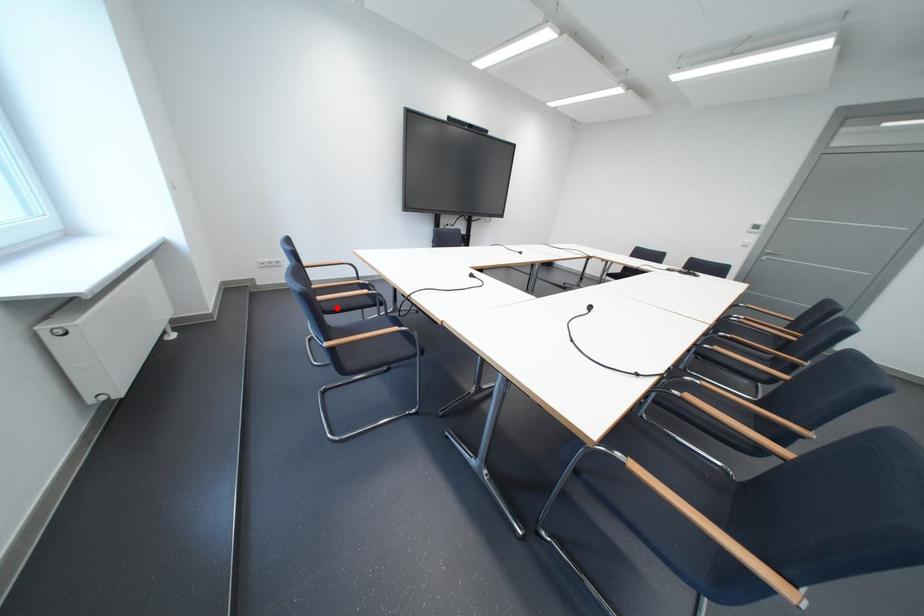
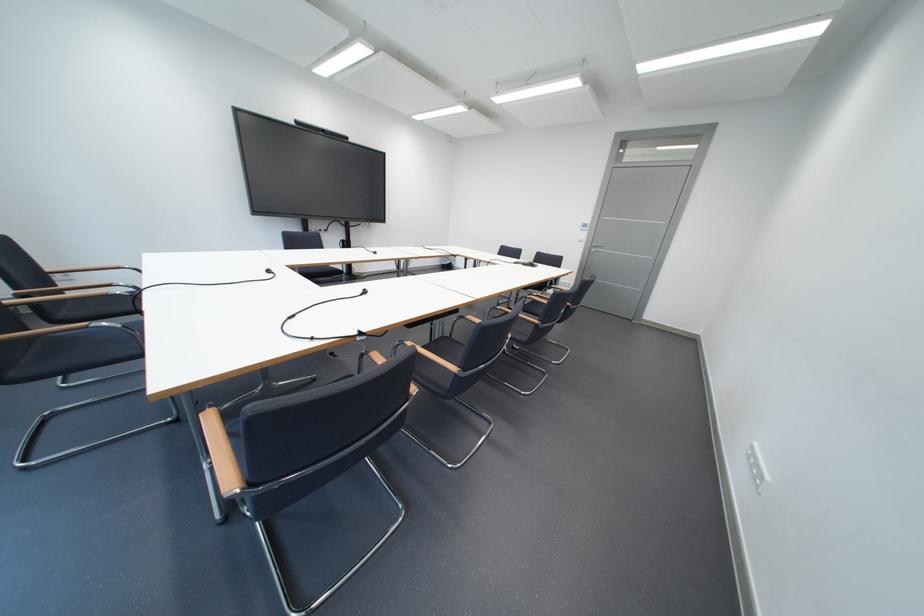
Where in the second image is the point corresponding to the highlighted location from the first image?

(74, 317)